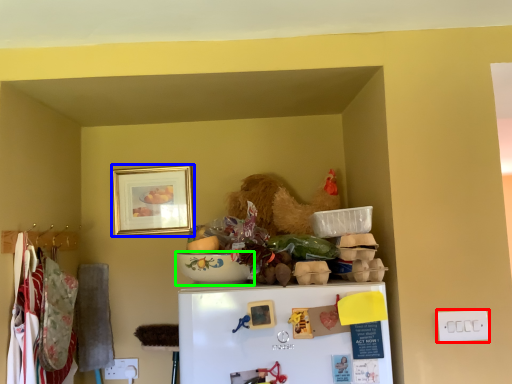
Question: Considering the real-world distances, which object is farthest from electric outlet (highlighted by a red box)? picture frame (highlighted by a blue box) or bowl (highlighted by a green box)?

Choices:
 (A) picture frame
 (B) bowl

Answer: (A)